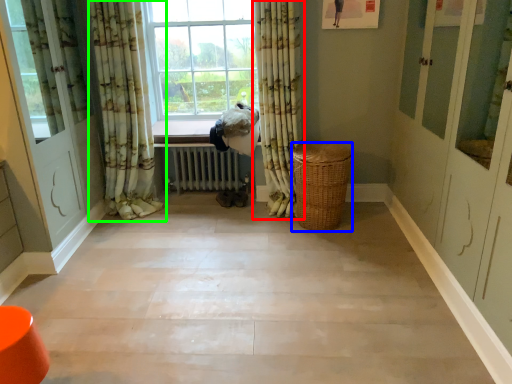
Question: Which is nearer to the curtain (highlighted by a red box)? basket (highlighted by a blue box) or curtain (highlighted by a green box).

Choices:
 (A) basket
 (B) curtain

Answer: (A)